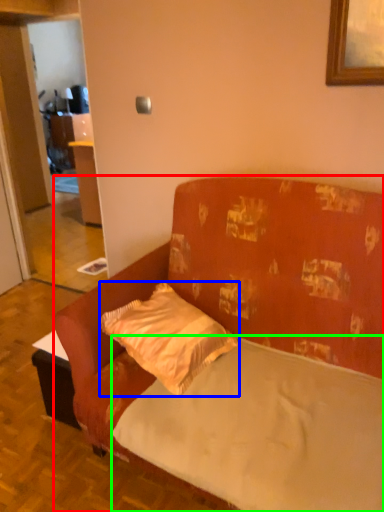
Question: Which is farther away from studio couch (highlighted by a red box)? pillow (highlighted by a blue box) or mattress (highlighted by a green box)?

Choices:
 (A) pillow
 (B) mattress

Answer: (A)